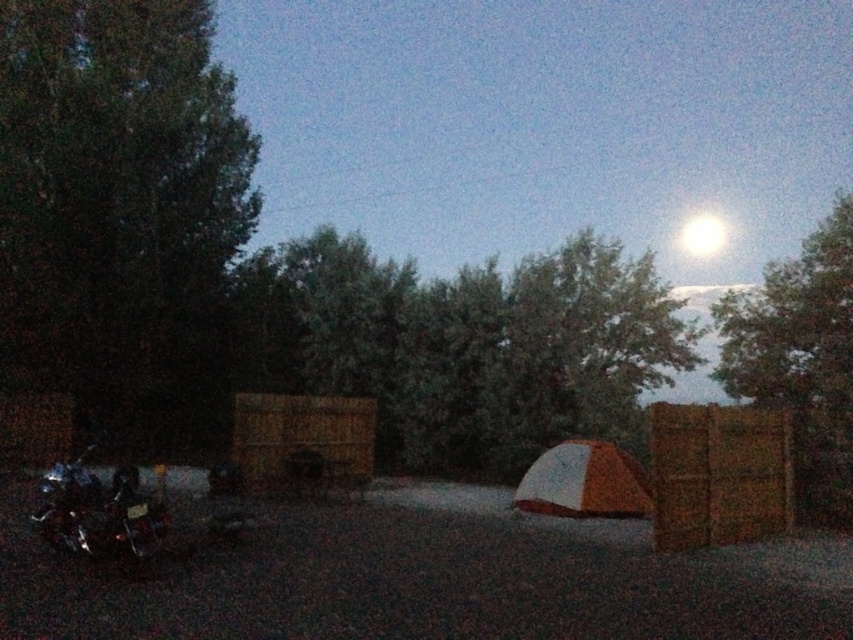
Question: Observing the image, what is the correct spatial positioning of brown woven crate at right in reference to wooden crate at center?

Choices:
 (A) left
 (B) right

Answer: (B)

Question: Does shiny chrome motorcycle at lower left come behind orange fabric tent at center?

Choices:
 (A) yes
 (B) no

Answer: (B)

Question: Which point is farther to the camera?

Choices:
 (A) (364, 442)
 (B) (689, 250)

Answer: (B)

Question: Can you confirm if brown woven crate at right is positioned to the right of wooden crate at center?

Choices:
 (A) no
 (B) yes

Answer: (B)

Question: Among these points, which one is farthest from the camera?

Choices:
 (A) (693, 234)
 (B) (7, 342)

Answer: (A)

Question: Which of the following is the farthest from the observer?

Choices:
 (A) shiny chrome motorcycle at lower left
 (B) brown woven crate at right

Answer: (B)